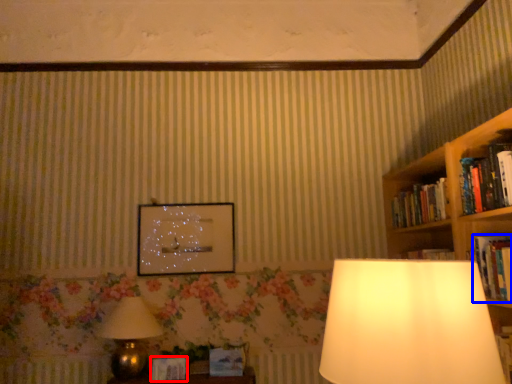
Question: Which object is further to the camera taking this photo, paperback book (highlighted by a red box) or book (highlighted by a blue box)?

Choices:
 (A) paperback book
 (B) book

Answer: (A)